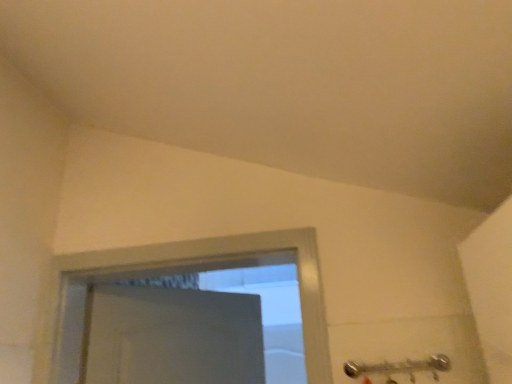
Question: Should I look upward or downward to see satin nickel shower at lower right?

Choices:
 (A) down
 (B) up

Answer: (A)